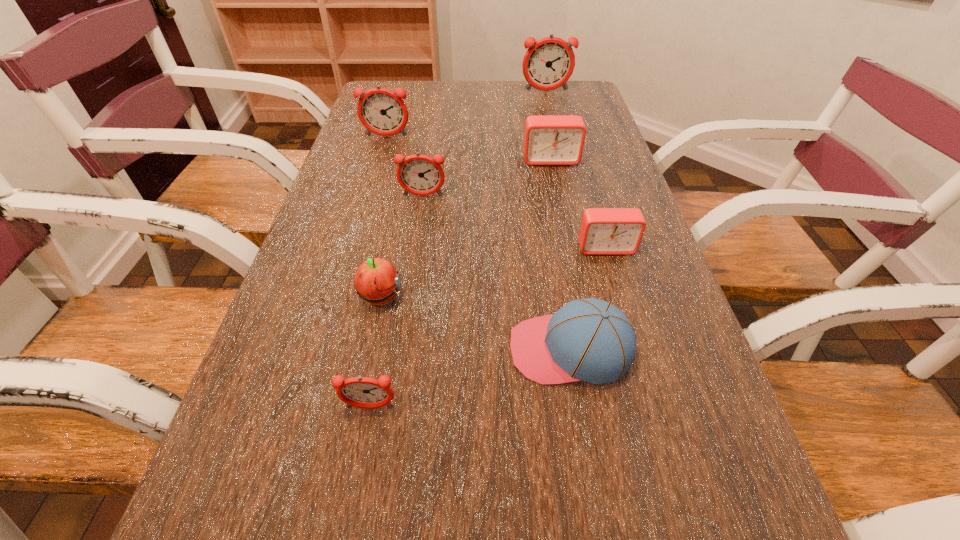
I want to click on free location located 0.070m on the front-facing side of the baseball cap, so click(469, 349).

What are the coordinates of `free space located 0.050m on the left of the apple` in the screenshot? It's located at (332, 298).

This screenshot has width=960, height=540. Find the location of `vacant space located on the front-facing side of the nearer red alarm clock`. vacant space located on the front-facing side of the nearer red alarm clock is located at coordinates (621, 299).

Locate an element on the screen. This screenshot has height=540, width=960. free space located 0.170m on the front-facing side of the nearest object is located at coordinates 347,536.

The width and height of the screenshot is (960, 540). In order to click on object present at the far edge in this screenshot , I will do `click(548, 64)`.

The width and height of the screenshot is (960, 540). In order to click on apple at the left edge in this screenshot , I will do `click(376, 281)`.

This screenshot has width=960, height=540. I want to click on baseball cap located in the right edge section of the desktop, so click(588, 339).

This screenshot has height=540, width=960. I want to click on object present at the far right corner, so click(x=548, y=64).

Locate an element on the screen. The height and width of the screenshot is (540, 960). blank space at the far edge of the desktop is located at coordinates (422, 105).

In the image, there is a desktop. In order to click on vacant space at the left edge in this screenshot , I will do `click(281, 437)`.